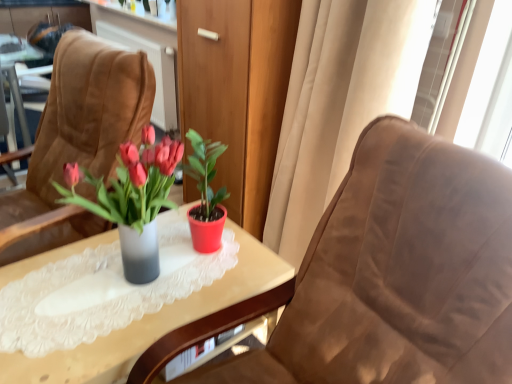
I want to click on vacant region under matte plastic vase at center (from a real-world perspective), so click(x=121, y=278).